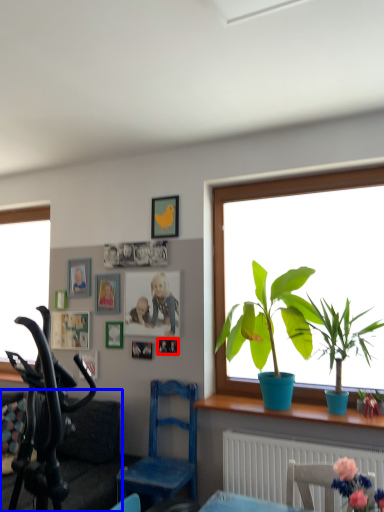
Question: Which point is closer to the camera, picture frame (highlighted by a red box) or couch (highlighted by a blue box)?

Choices:
 (A) picture frame
 (B) couch

Answer: (B)